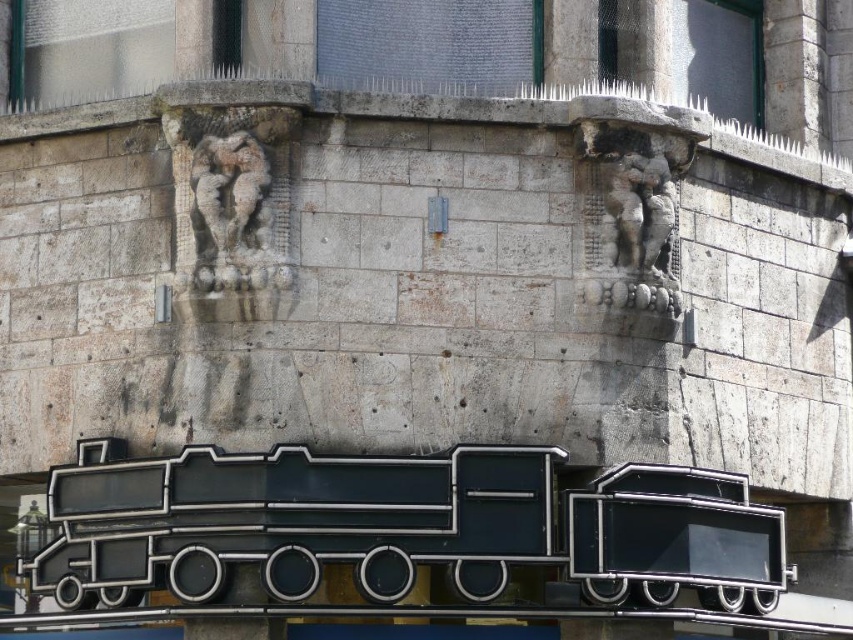
You are an architect examining the building facade. You notice a point marked at coordinates (637,211). Based on the scene, what object or feature is located at that point?

The point at coordinates (637,211) corresponds to the rustic stone cherubim at upper right.